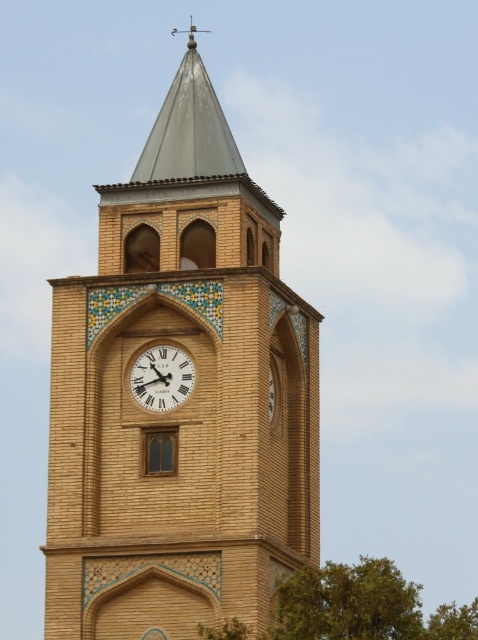
Question: Based on their relative distances, which object is farther from the white wooden clock at center?

Choices:
 (A) brown brick clock tower at center
 (B) green leafy tree at lower right

Answer: (B)

Question: Estimate the real-world distances between objects in this image. Which object is farther from the white wooden clock at center?

Choices:
 (A) green leafy tree at lower right
 (B) brown brick clock tower at center

Answer: (A)

Question: Can you confirm if brown brick clock tower at center is positioned above white wooden clock at center?

Choices:
 (A) yes
 (B) no

Answer: (A)

Question: Which point appears farthest from the camera in this image?

Choices:
 (A) (132, 381)
 (B) (475, 636)

Answer: (A)

Question: Does brown brick clock tower at center appear on the right side of white wooden clock at center?

Choices:
 (A) yes
 (B) no

Answer: (B)

Question: Is the position of green leafy tree at lower right more distant than that of white wooden clock at center?

Choices:
 (A) no
 (B) yes

Answer: (A)